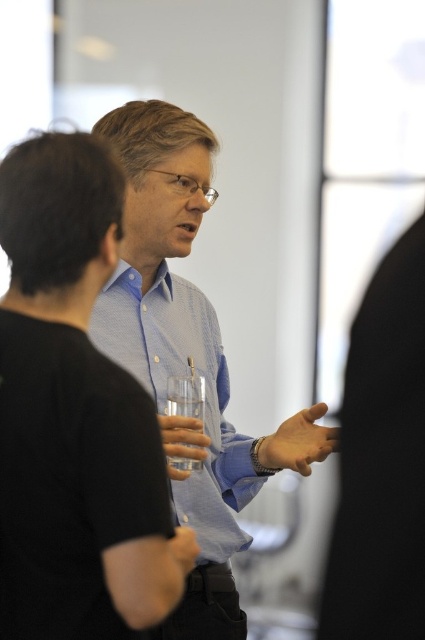
Question: Which object appears farthest from the camera in this image?

Choices:
 (A) light blue button-down shirt at center
 (B) blue woven shirt at center

Answer: (A)

Question: Does blue woven shirt at center appear over matte black hand at center?

Choices:
 (A) yes
 (B) no

Answer: (A)

Question: Considering the relative positions of clear plastic glass at center and clear glass at center in the image provided, where is clear plastic glass at center located with respect to clear glass at center?

Choices:
 (A) above
 (B) below

Answer: (B)

Question: Which object is farther from the camera taking this photo?

Choices:
 (A) clear glass at center
 (B) smooth skin hand at center
 (C) light blue button-down shirt at center
 (D) blue woven shirt at center

Answer: (C)

Question: Can you confirm if blue checkered shirt at center is positioned to the right of smooth skin hand at center?

Choices:
 (A) no
 (B) yes

Answer: (A)

Question: Which object appears closest to the camera in this image?

Choices:
 (A) smooth skin hand at center
 (B) blue checkered shirt at center

Answer: (B)